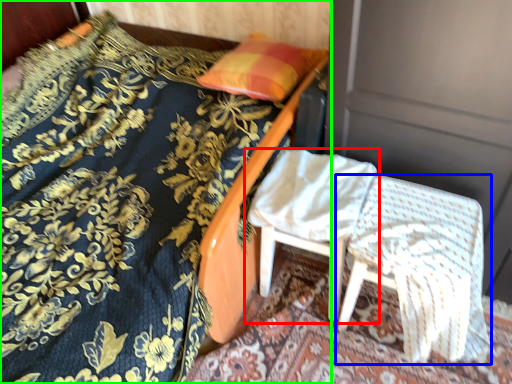
Question: Which object is positioned farthest from chair (highlighted by a red box)? Select from chair (highlighted by a blue box) and bed (highlighted by a green box).

Choices:
 (A) chair
 (B) bed

Answer: (B)